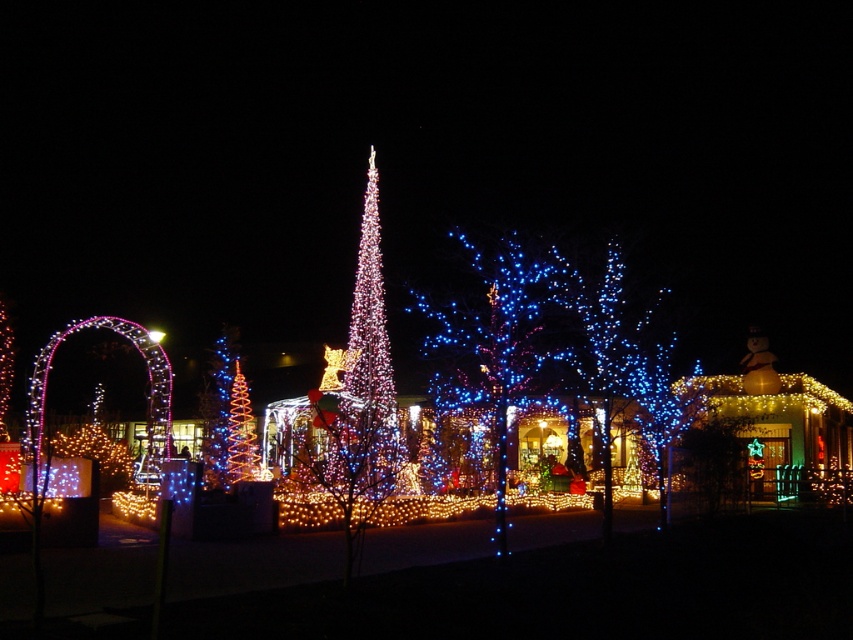
You are standing in the festive nighttime scene and want to locate the point at coordinates (498,339). Which object in the scene is this point located on?

The point at coordinates (498,339) is located on the blue glossy tree at center.